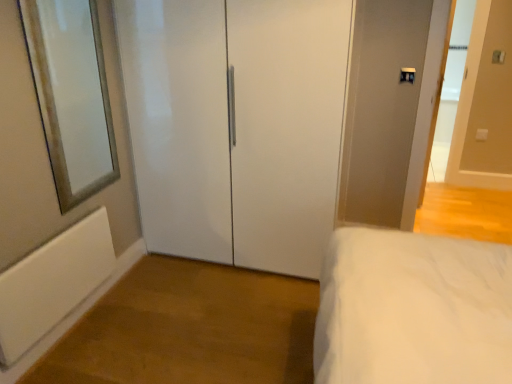
Find the location of a particular element. The height and width of the screenshot is (384, 512). vacant space in white matte radiator at lower left (from a real-world perspective) is located at coordinates (77, 326).